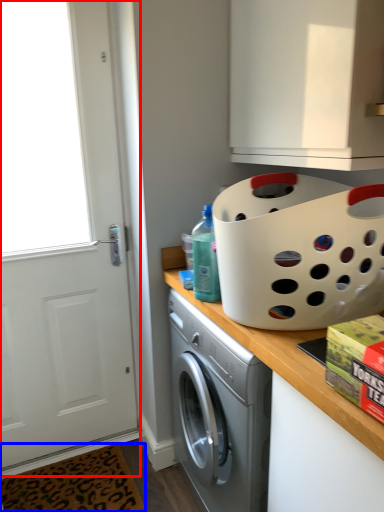
Question: Among these objects, which one is nearest to the camera, screen door (highlighted by a red box) or doormat (highlighted by a blue box)?

Choices:
 (A) screen door
 (B) doormat

Answer: (A)